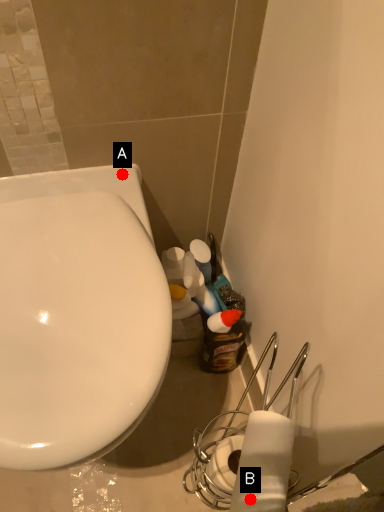
Question: Two points are circled on the image, labeled by A and B beside each circle. Which of the following is the farthest from the observer?

Choices:
 (A) A is further
 (B) B is further

Answer: (A)